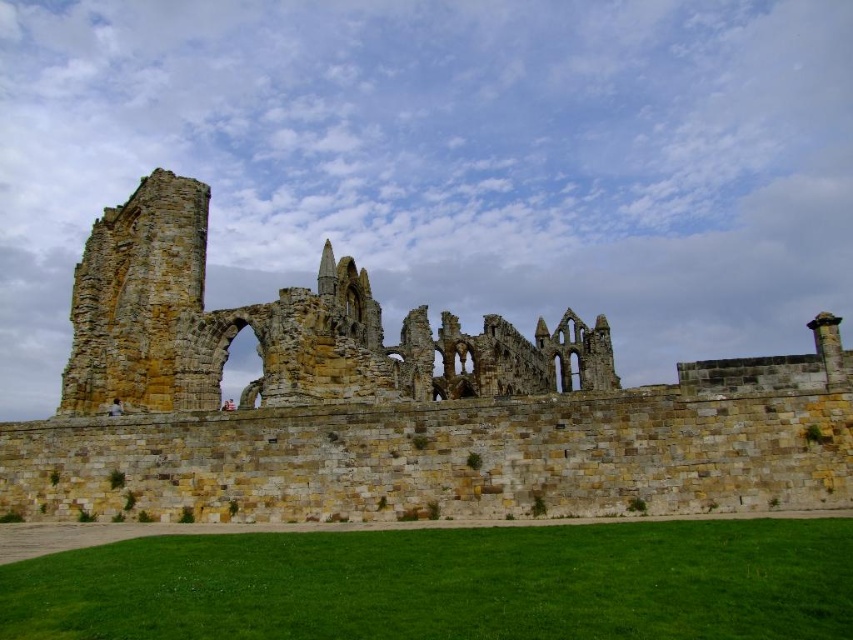
Between brown stone ruins at center and stone ruins at center, which one has less height?

With less height is stone ruins at center.

Describe the element at coordinates (390, 404) in the screenshot. This screenshot has width=853, height=640. I see `brown stone ruins at center` at that location.

Which is in front, point (144, 410) or point (146, 253)?

Point (144, 410)

The image size is (853, 640). Identify the location of brown stone ruins at center. (390, 404).